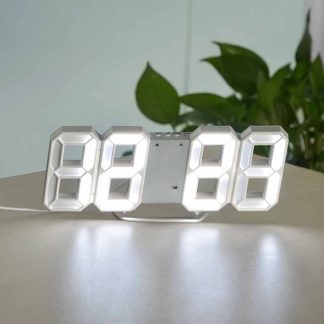
You are a GUI agent. You are given a task and a screenshot of the screen. Output one action in this format:
    pyautogui.click(x=<x>, y=<y>)
    Task: Click on the clock
    The width and height of the screenshot is (324, 324).
    Given the screenshot: What is the action you would take?
    pyautogui.click(x=161, y=154)